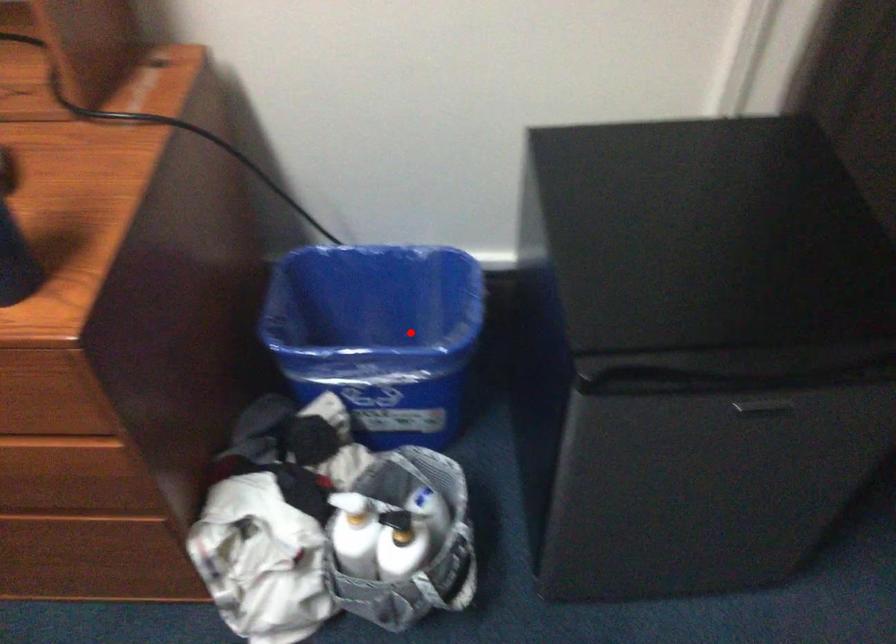
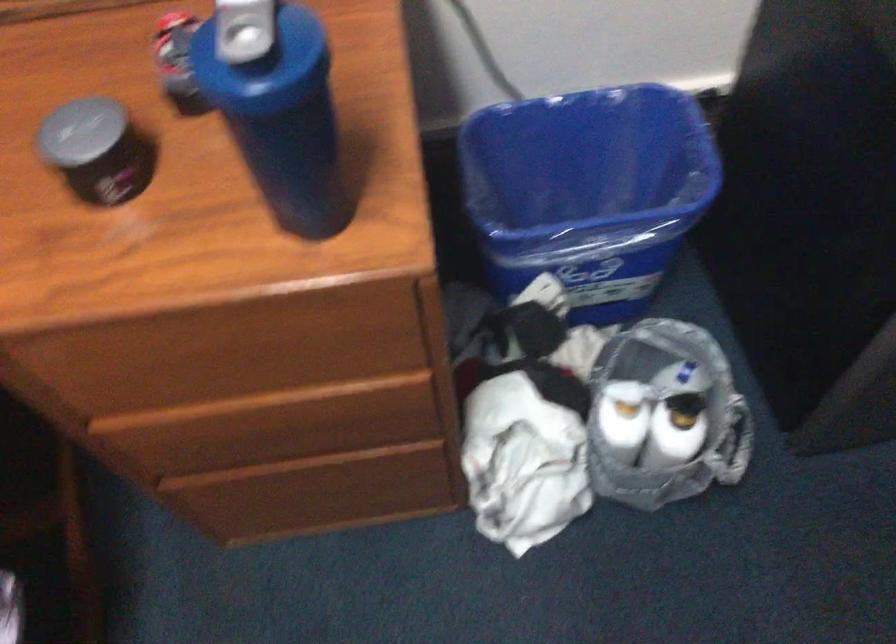
Locate, in the second image, the point that corresponds to the highlighted location in the first image.

(588, 192)